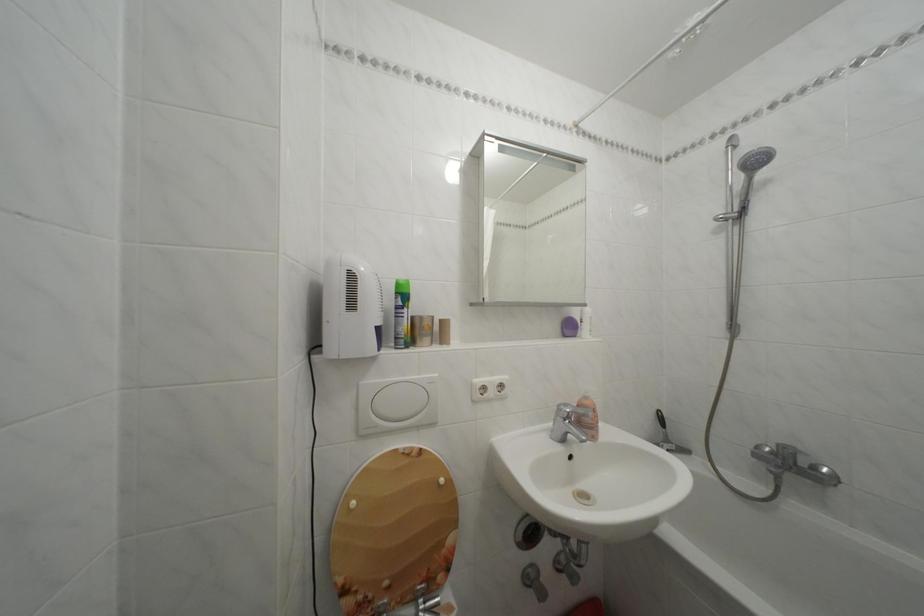
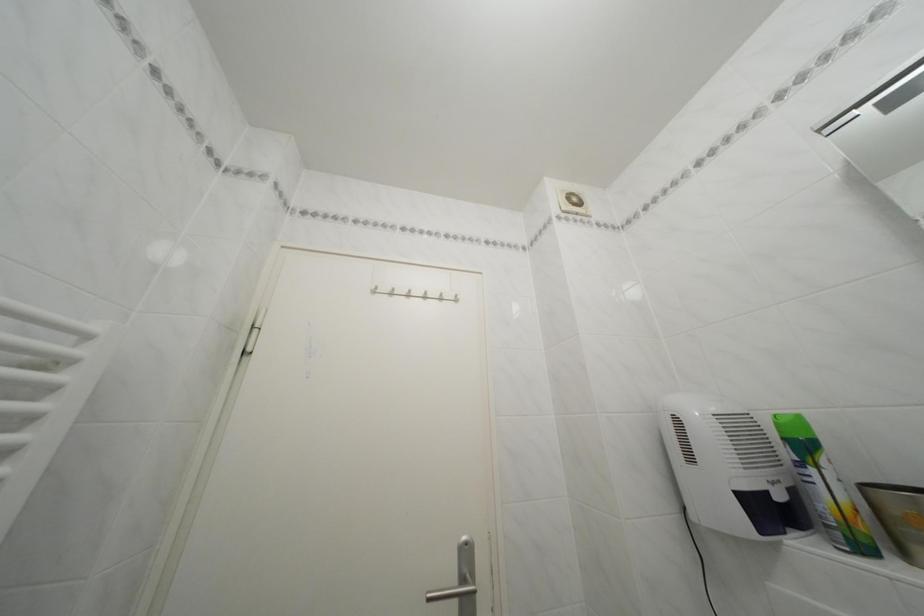
How did the camera likely rotate?

The rotation direction of the camera is left-up.